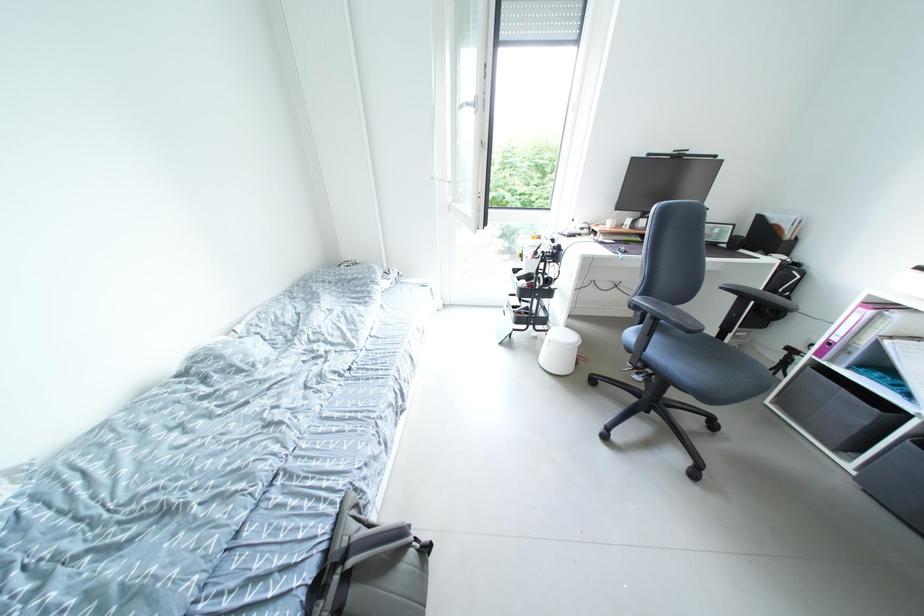
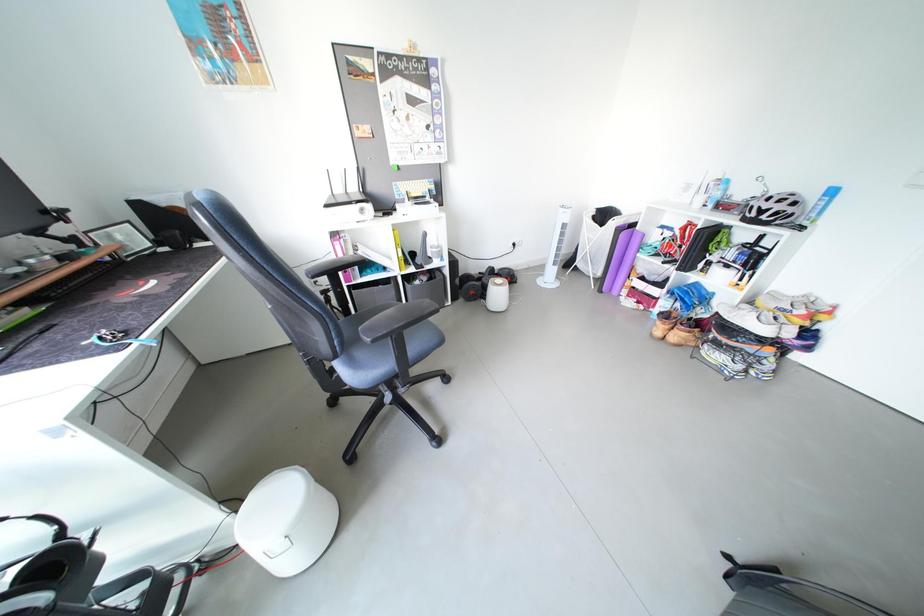
The first image is from the beginning of the video and the second image is from the end. How did the camera likely rotate when shooting the video?

The camera rotated toward right-down.